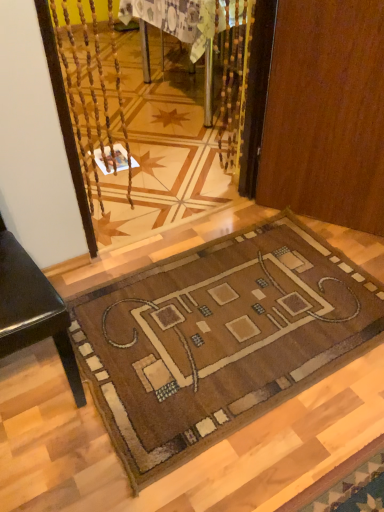
Locate an element on the screen. The image size is (384, 512). blank space situated above brown woven mat at lower center (from a real-world perspective) is located at coordinates (223, 329).